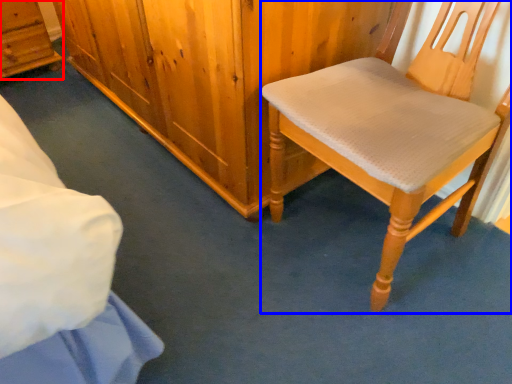
Question: Which point is further to the camera, cabinetry (highlighted by a red box) or chair (highlighted by a blue box)?

Choices:
 (A) cabinetry
 (B) chair

Answer: (A)